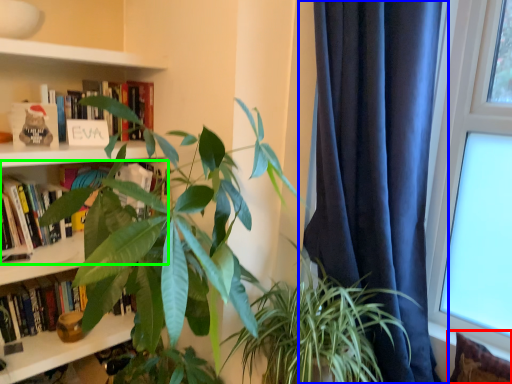
Question: Which object is positioned closest to pillow (highlighted by a red box)? Select from curtain (highlighted by a blue box) and book (highlighted by a green box).

Choices:
 (A) curtain
 (B) book

Answer: (A)